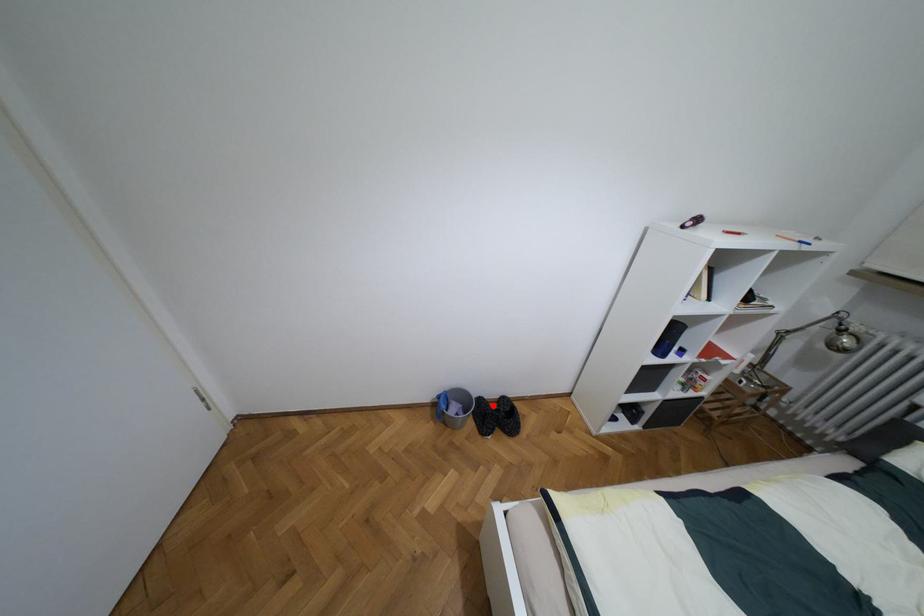
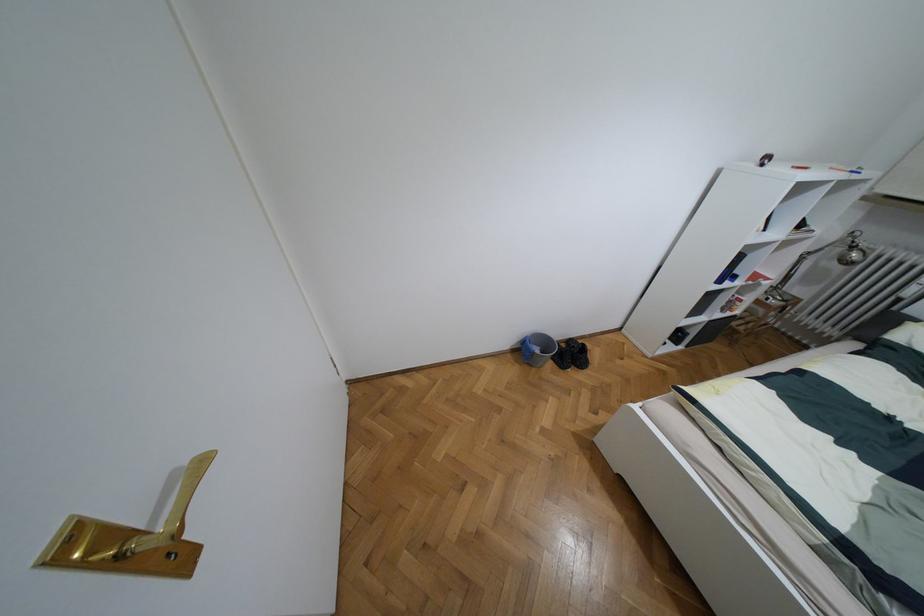
The point at the highlighted location is marked in the first image. Where is the corresponding point in the second image?

(563, 345)